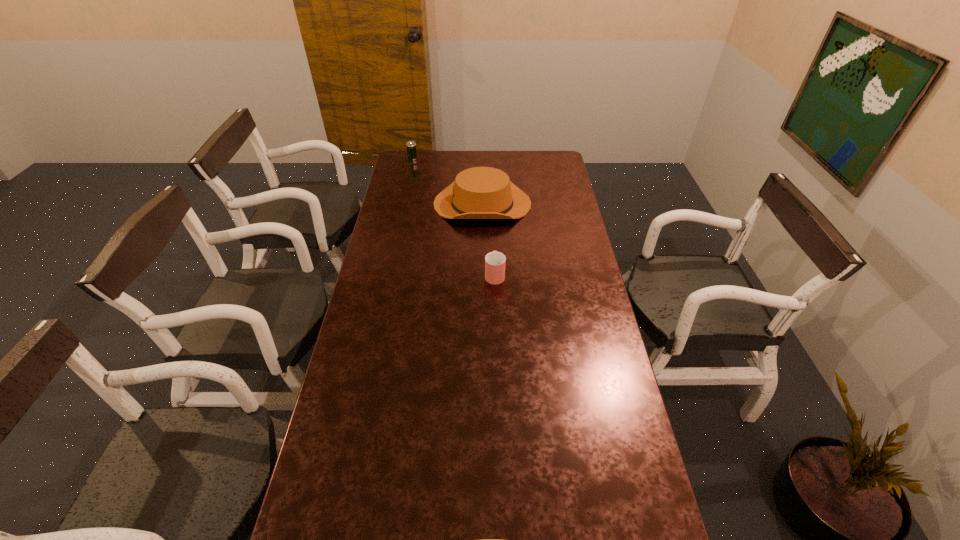
Where is `the third nearest object`? The image size is (960, 540). the third nearest object is located at coordinates (480, 192).

Locate an element on the screen. the farthest object is located at coordinates (411, 145).

The width and height of the screenshot is (960, 540). Identify the location of the leftmost object. (411, 145).

Locate an element on the screen. cup is located at coordinates (495, 261).

In order to click on vacant region located on the front-facing side of the second farthest object in this screenshot , I will do `click(398, 204)`.

Where is `vacant space located on the front-facing side of the second farthest object`? The width and height of the screenshot is (960, 540). vacant space located on the front-facing side of the second farthest object is located at coordinates click(x=419, y=204).

Locate an element on the screen. Image resolution: width=960 pixels, height=540 pixels. vacant space situated on the front-facing side of the second farthest object is located at coordinates (420, 204).

At what (x,y) coordinates should I click in order to perform the action: click on vacant space situated on the right of the farthest object. Please return your answer as a coordinate pair (x, y). Image resolution: width=960 pixels, height=540 pixels. Looking at the image, I should click on (467, 162).

Where is `blank area located on the side of the cup with the handle`? This screenshot has height=540, width=960. blank area located on the side of the cup with the handle is located at coordinates (492, 207).

Identify the location of free space located 0.090m on the side of the cup with the handle. Image resolution: width=960 pixels, height=540 pixels. (493, 249).